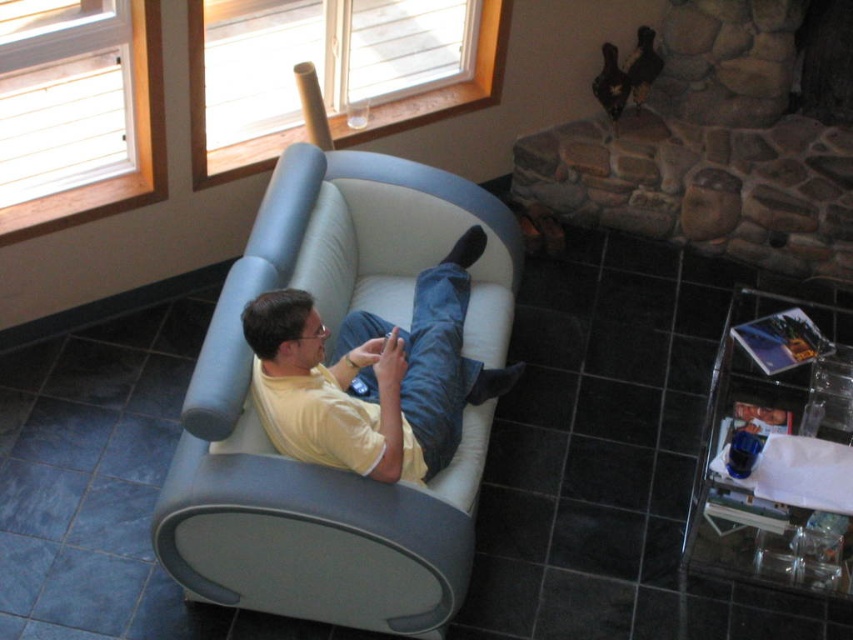
You are a photographer setting up a shoot in this living room. You want to position a small lamp between the matte gray couch at center and the yellow matte shirt at center. Based on their positions, where should the lamp be placed relative to the couch?

The lamp should be placed above the matte gray couch at center since the yellow matte shirt at center is above it, and the lamp needs to be between them.

You are standing at the entrance of the living room and want to sit on the matte gray couch at center. Which direction should you walk to reach it?

The matte gray couch at center is located at point 0.733 on the x and 0.388 on the y, so you should walk towards the center of the room to reach it.

You are standing in the living room and see two points marked in the image. Which point is closer to you, point (x=419, y=230) or point (x=398, y=380)?

Point (x=419, y=230) is closer to you because it is further to the viewer than point (x=398, y=380).